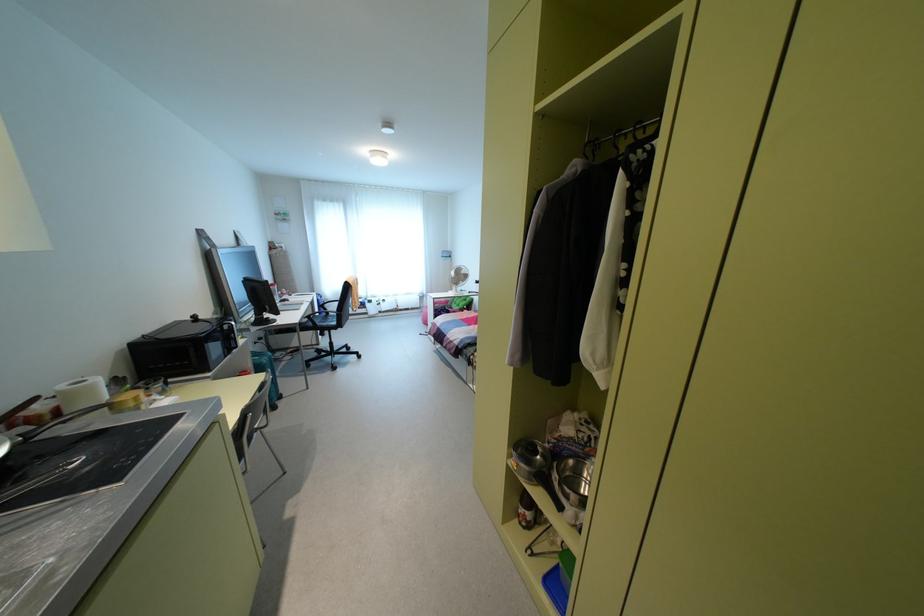
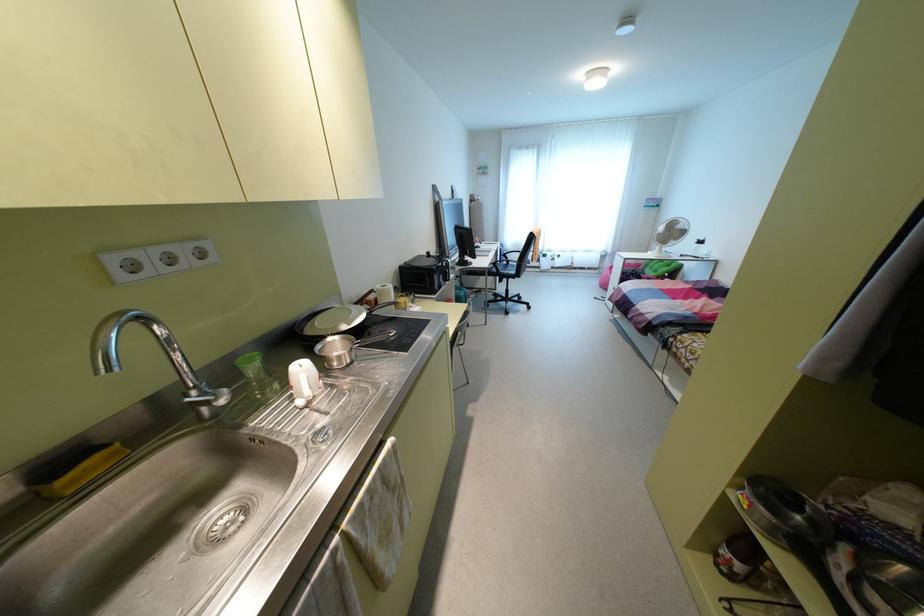
Question: The camera is either moving clockwise (left) or counter-clockwise (right) around the object. The first image is from the beginning of the video and the second image is from the end. Is the camera moving left or right when shooting the video?

Choices:
 (A) Left
 (B) Right

Answer: (B)